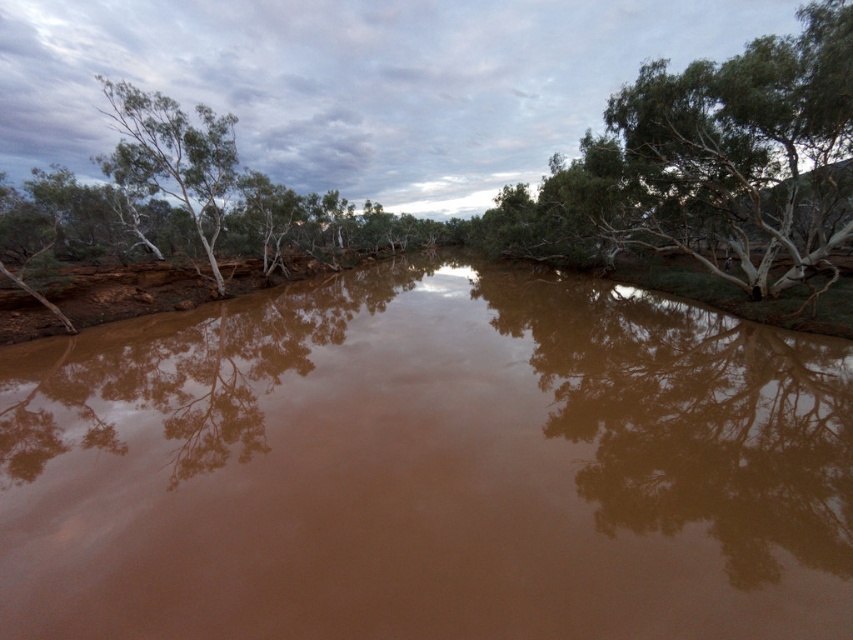
Which is in front, point (618, 115) or point (212, 172)?

Point (618, 115) is in front.

Between green leafy tree at center and green leafy tree at left, which one is positioned higher?

green leafy tree at left

In order to click on green leafy tree at center in this screenshot , I will do `click(711, 163)`.

Between point (546, 605) and point (175, 113), which one is positioned behind?

The point (175, 113) is more distant.

Who is more distant from viewer, (233, 410) or (216, 212)?

Positioned behind is point (216, 212).

Find the location of `brown muddy water at center`. brown muddy water at center is located at coordinates (428, 467).

The height and width of the screenshot is (640, 853). What are the coordinates of `brown muddy water at center` in the screenshot? It's located at (428, 467).

Can you confirm if brown muddy water at center is thinner than green leafy tree at center?

Incorrect, brown muddy water at center's width is not less than green leafy tree at center's.

Identify the location of brown muddy water at center. This screenshot has height=640, width=853. (428, 467).